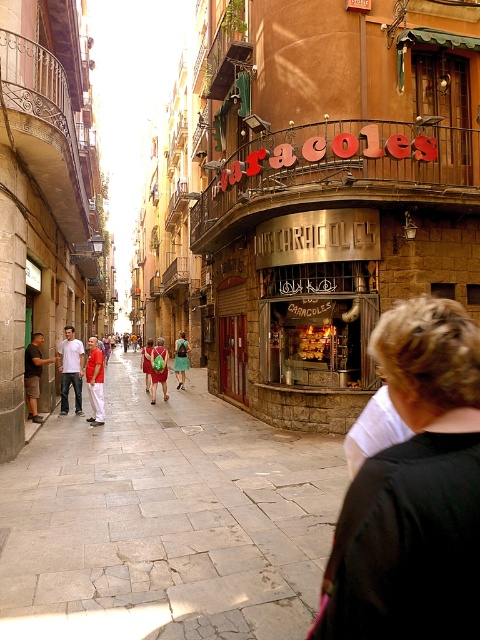
Question: Which object is farther from the camera taking this photo?

Choices:
 (A) blurred hair at center
 (B) green fabric bag at center
 (C) matte khaki shorts at left
 (D) gray stone pavement at center

Answer: (B)

Question: Which object is positioned closest to the red fabric pants at left?

Choices:
 (A) matte khaki shorts at left
 (B) red shirt at center

Answer: (B)

Question: Can you confirm if red shirt at center is positioned to the right of green backpack at center?

Choices:
 (A) no
 (B) yes

Answer: (A)

Question: Which object is the closest to the blurred hair at center?

Choices:
 (A) green backpack at center
 (B) red shirt at center
 (C) green fabric bag at center

Answer: (B)

Question: Is gray stone pavement at center to the right of green backpack at center from the viewer's perspective?

Choices:
 (A) no
 (B) yes

Answer: (B)

Question: Where is gray stone pavement at center located in relation to green fabric dress at center in the image?

Choices:
 (A) right
 (B) left

Answer: (A)